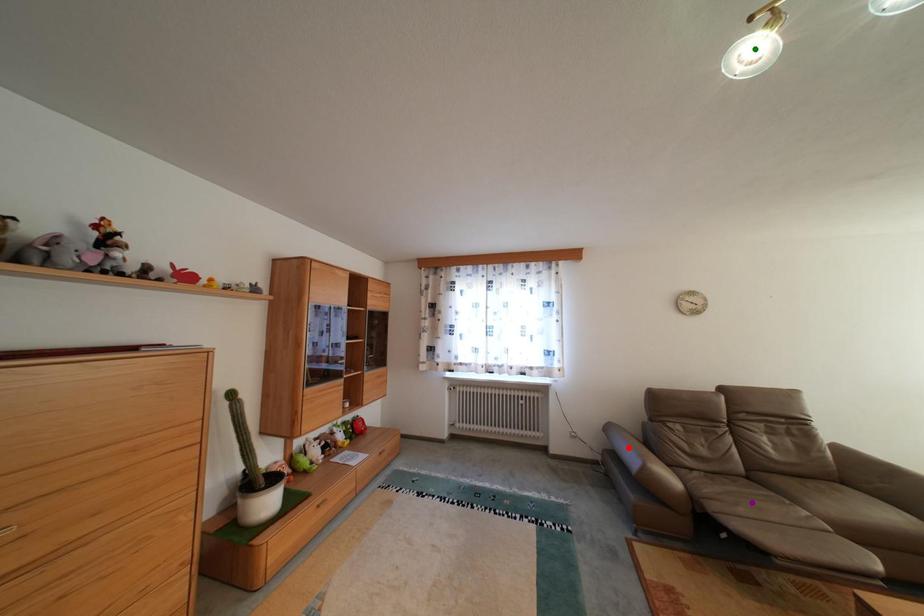
Order these from nearest to farthest:
green point | purple point | red point

green point → purple point → red point